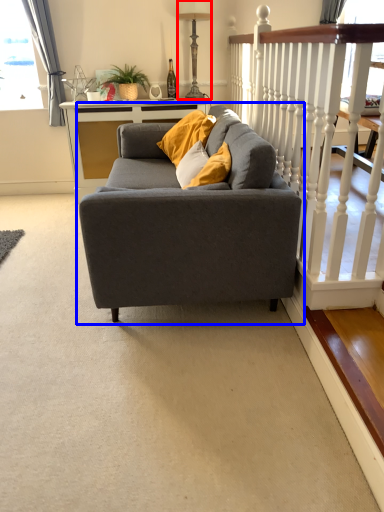
Question: Which point is further to the camera, lamp (highlighted by a red box) or studio couch (highlighted by a blue box)?

Choices:
 (A) lamp
 (B) studio couch

Answer: (A)